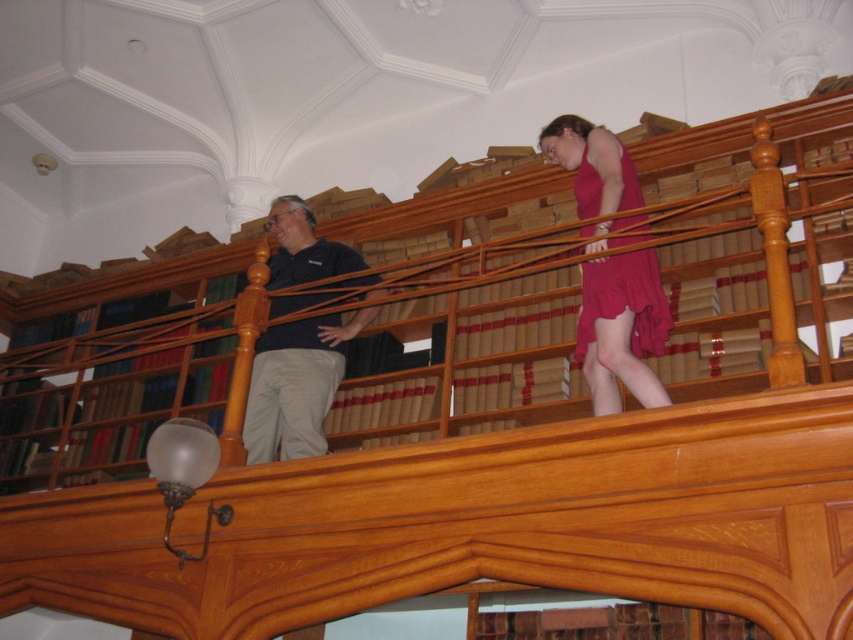
Between brown wood bookcase at upper center and matte red dress at center, which one has less height?

matte red dress at center is shorter.

Who is more distant from viewer, (447, 296) or (653, 268)?

The point (447, 296) is behind.

Does point (764, 371) come in front of point (622, 237)?

No, (764, 371) is further to viewer.

You are a GUI agent. You are given a task and a screenshot of the screen. Output one action in this format:
    pyautogui.click(x=<x>, y=<y>)
    Task: Click on the brown wood bookcase at upper center
    The height and width of the screenshot is (640, 853).
    Given the screenshot: What is the action you would take?
    pyautogui.click(x=469, y=310)

Is point (283, 456) positioned behind point (604, 260)?

That is True.

Between point (364, 316) and point (643, 346), which one is positioned behind?

Point (364, 316)

At what (x,y) coordinates should I click in order to perform the action: click on black matte shirt at center. Please return your answer as a coordinate pair (x, y). The image size is (853, 640). Looking at the image, I should click on [296, 385].

Where is `black matte shirt at center`? The width and height of the screenshot is (853, 640). black matte shirt at center is located at coordinates (296, 385).

Between brown wood bookcase at upper center and black matte shirt at center, which one is positioned higher?

black matte shirt at center

You are a GUI agent. You are given a task and a screenshot of the screen. Output one action in this format:
    pyautogui.click(x=<x>, y=<y>)
    Task: Click on the brown wood bookcase at upper center
    The height and width of the screenshot is (640, 853).
    Given the screenshot: What is the action you would take?
    pyautogui.click(x=469, y=310)